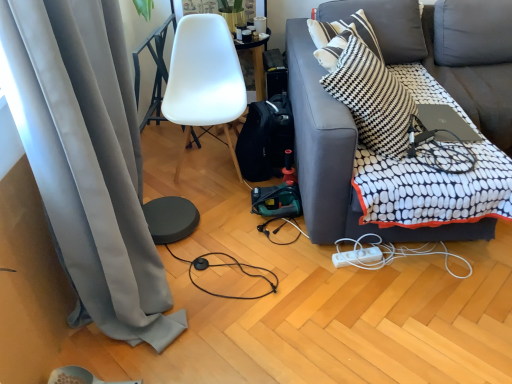
The image size is (512, 384). Identify the location of vacant area situated below gray fabric curtain at left (from a real-world perspective). (143, 347).